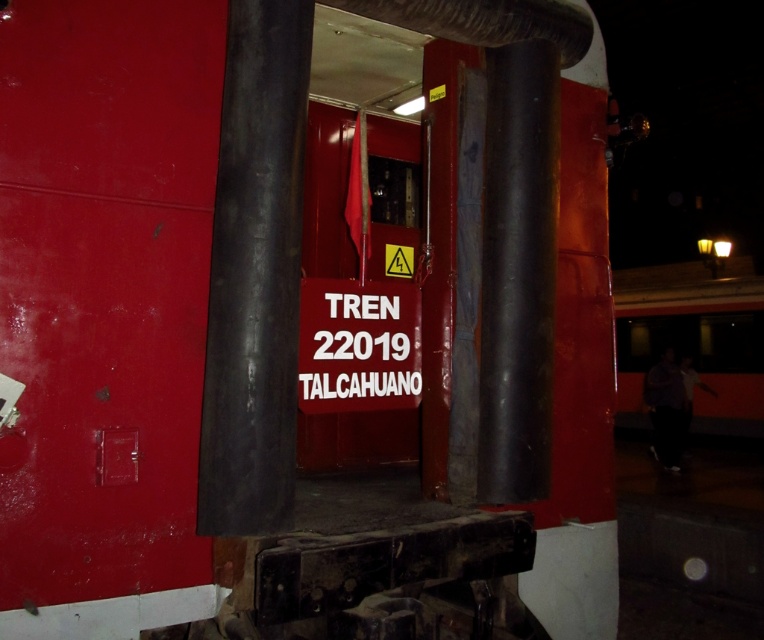
Question: Can you confirm if smooth black pole at center is bigger than white plastic sign at center?

Choices:
 (A) yes
 (B) no

Answer: (B)

Question: Does smooth black pole at center have a greater width compared to white plastic sign at center?

Choices:
 (A) yes
 (B) no

Answer: (B)

Question: From the image, what is the correct spatial relationship of smooth black pole at center in relation to white plastic sign at center?

Choices:
 (A) below
 (B) above

Answer: (B)